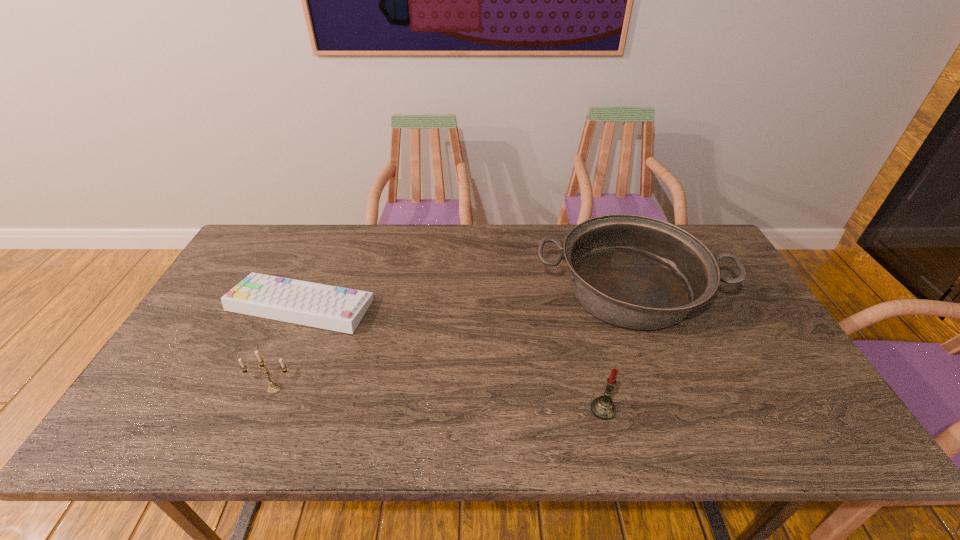
Locate an element on the screen. vacant region between the nearer candle and the left candle is located at coordinates (439, 399).

At what (x,y) coordinates should I click in order to perform the action: click on empty space that is in between the shortest object and the second nearest object. Please return your answer as a coordinate pair (x, y). The image size is (960, 540). Looking at the image, I should click on (287, 347).

You are a GUI agent. You are given a task and a screenshot of the screen. Output one action in this format:
    pyautogui.click(x=<x>, y=<y>)
    Task: Click on the object that stands as the third closest to the second nearest object
    
    Given the screenshot: What is the action you would take?
    pyautogui.click(x=602, y=407)

Find the location of a particular element. object that ranks as the third closest to the shortest object is located at coordinates (602, 407).

At what (x,y) coordinates should I click in order to perform the action: click on free spot that satisfies the following two spatial constraints: 1. on the back side of the pan; 2. on the right side of the nearer candle. Please return your answer as a coordinate pair (x, y). The height and width of the screenshot is (540, 960). Looking at the image, I should click on [x=575, y=290].

Locate an element on the screen. vacant space that satisfies the following two spatial constraints: 1. on the front side of the computer keyboard; 2. on the right side of the nearer candle is located at coordinates (255, 409).

The height and width of the screenshot is (540, 960). What are the coordinates of `vacant region that satisfies the following two spatial constraints: 1. on the front side of the second nearest object; 2. on the right side of the shortest object` in the screenshot? It's located at (264, 388).

The image size is (960, 540). I want to click on vacant point that satisfies the following two spatial constraints: 1. on the back side of the pan; 2. on the left side of the left candle, so click(x=315, y=290).